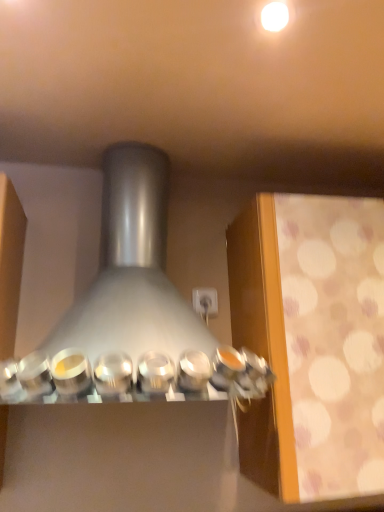
In order to face satin silver range hood at center, should I rotate leftwards or rightwards?

To align with it, rotate left about 7.060°.

Describe the element at coordinates (132, 307) in the screenshot. This screenshot has width=384, height=512. I see `satin silver range hood at center` at that location.

Where is `satin silver range hood at center`? satin silver range hood at center is located at coordinates (132, 307).

Measure the distance between point (95,284) and camera.

The distance of point (95,284) from camera is 3.39 feet.

Identify the location of white glossy light bulb at upper center. (275, 16).

What is the approximate height of white glossy light bulb at upper center?

white glossy light bulb at upper center is 1.03 inches in height.

What do you see at coordinates (275, 16) in the screenshot? This screenshot has height=512, width=384. I see `white glossy light bulb at upper center` at bounding box center [275, 16].

Find the location of `satin silver range hood at center`. satin silver range hood at center is located at coordinates (132, 307).

Does white glossy light bulb at upper center appear on the left side of satin silver range hood at center?

In fact, white glossy light bulb at upper center is to the right of satin silver range hood at center.

Is white glossy light bulb at upper center positioned before satin silver range hood at center?

That is False.

Which is behind, point (287, 7) or point (99, 381)?

The point (287, 7) is more distant.

From the image's perspective, does white glossy light bulb at upper center appear higher than satin silver range hood at center?

Yes, from the image's perspective, white glossy light bulb at upper center is on top of satin silver range hood at center.

From a real-world perspective, is white glossy light bulb at upper center below satin silver range hood at center?

No, from a real-world perspective, white glossy light bulb at upper center is not beneath satin silver range hood at center.

Is white glossy light bulb at upper center wider than satin silver range hood at center?

Incorrect, the width of white glossy light bulb at upper center does not surpass that of satin silver range hood at center.

Does white glossy light bulb at upper center have a lesser height compared to satin silver range hood at center?

Correct, white glossy light bulb at upper center is not as tall as satin silver range hood at center.

Based on the photo, is white glossy light bulb at upper center bigger than satin silver range hood at center?

No, white glossy light bulb at upper center is not bigger than satin silver range hood at center.

In the scene shown: Is white glossy light bulb at upper center situated inside satin silver range hood at center or outside?

white glossy light bulb at upper center cannot be found inside satin silver range hood at center.

Would you say white glossy light bulb at upper center is a long distance from satin silver range hood at center?

white glossy light bulb at upper center is actually quite close to satin silver range hood at center.

Is white glossy light bulb at upper center turned away from satin silver range hood at center?

white glossy light bulb at upper center does not have its back to satin silver range hood at center.

How different are the orientations of white glossy light bulb at upper center and satin silver range hood at center in degrees?

0.898 degrees.

This screenshot has height=512, width=384. I want to click on kitchen appliance that is on the left side of white glossy light bulb at upper center, so click(x=132, y=307).

Visually, is satin silver range hood at center positioned to the left or to the right of white glossy light bulb at upper center?

Clearly, satin silver range hood at center is on the left of white glossy light bulb at upper center in the image.

Which object is closer to the camera, satin silver range hood at center or white glossy light bulb at upper center?

satin silver range hood at center is in front.

Considering the positions of point (8, 362) and point (265, 9), is point (8, 362) closer or farther from the camera than point (265, 9)?

Point (8, 362) is farther from the camera than point (265, 9).

From the image's perspective, would you say satin silver range hood at center is positioned over white glossy light bulb at upper center?

No, from the image's perspective, satin silver range hood at center is not above white glossy light bulb at upper center.

Looking at this image, from a real-world perspective, between satin silver range hood at center and white glossy light bulb at upper center, who is vertically higher?

white glossy light bulb at upper center is physically above.

Is satin silver range hood at center wider or thinner than white glossy light bulb at upper center?

In the image, satin silver range hood at center appears to be wider than white glossy light bulb at upper center.

Which of these two, satin silver range hood at center or white glossy light bulb at upper center, stands shorter?

With less height is white glossy light bulb at upper center.

Does satin silver range hood at center have a smaller size compared to white glossy light bulb at upper center?

Actually, satin silver range hood at center might be larger than white glossy light bulb at upper center.

Is satin silver range hood at center not within white glossy light bulb at upper center?

satin silver range hood at center is positioned outside white glossy light bulb at upper center.

Are satin silver range hood at center and white glossy light bulb at upper center far apart?

No, satin silver range hood at center is not far from white glossy light bulb at upper center.

Is satin silver range hood at center positioned with its back to white glossy light bulb at upper center?

No, satin silver range hood at center is not facing the opposite direction of white glossy light bulb at upper center.

Locate an element on the screen. This screenshot has width=384, height=512. lighting above the satin silver range hood at center (from a real-world perspective) is located at coordinates (275, 16).

You are a GUI agent. You are given a task and a screenshot of the screen. Output one action in this format:
    pyautogui.click(x=<x>, y=<y>)
    Task: Click on the kitchen appliance that appears on the left of white glossy light bulb at upper center
    The height and width of the screenshot is (512, 384).
    Given the screenshot: What is the action you would take?
    pyautogui.click(x=132, y=307)

Image resolution: width=384 pixels, height=512 pixels. Find the location of `lighting lying on the right of satin silver range hood at center`. lighting lying on the right of satin silver range hood at center is located at coordinates (275, 16).